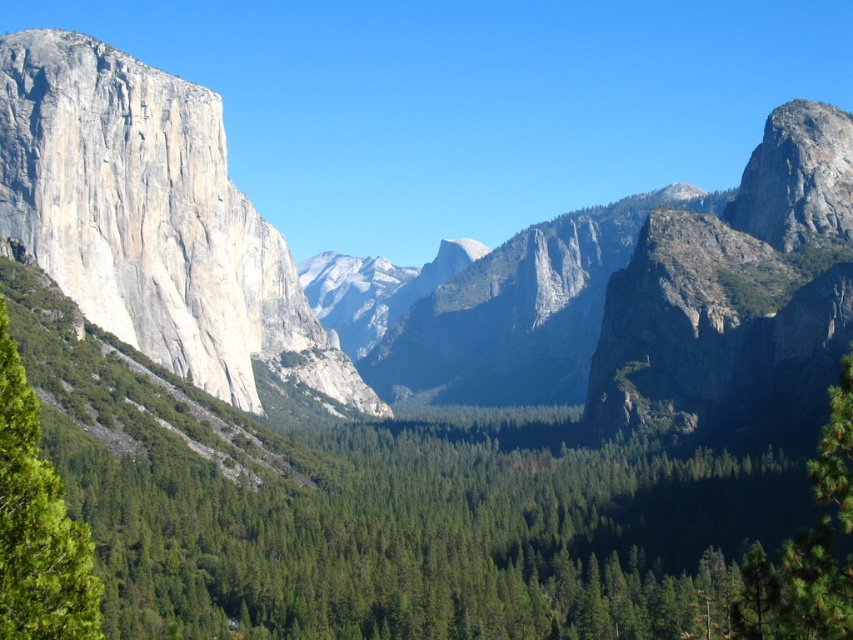
Can you confirm if granite cliff face at left is bigger than green leafy tree at left?

Yes.

Which is above, granite cliff face at left or green leafy tree at left?

Positioned higher is granite cliff face at left.

The height and width of the screenshot is (640, 853). What are the coordinates of `granite cliff face at left` in the screenshot? It's located at (152, 220).

Describe the element at coordinates (151, 218) in the screenshot. I see `gray rock formation at center` at that location.

Locate an element on the screen. This screenshot has width=853, height=640. gray rock formation at center is located at coordinates (151, 218).

What do you see at coordinates (151, 218) in the screenshot?
I see `gray rock formation at center` at bounding box center [151, 218].

In order to click on gray rock formation at center in this screenshot , I will do `click(151, 218)`.

Looking at this image, is gray rock formation at center thinner than granite cliff face at left?

Incorrect, gray rock formation at center's width is not less than granite cliff face at left's.

Can you confirm if gray rock formation at center is shorter than granite cliff face at left?

In fact, gray rock formation at center may be taller than granite cliff face at left.

Describe the element at coordinates (151, 218) in the screenshot. The image size is (853, 640). I see `gray rock formation at center` at that location.

Where is `gray rock formation at center`? gray rock formation at center is located at coordinates (151, 218).